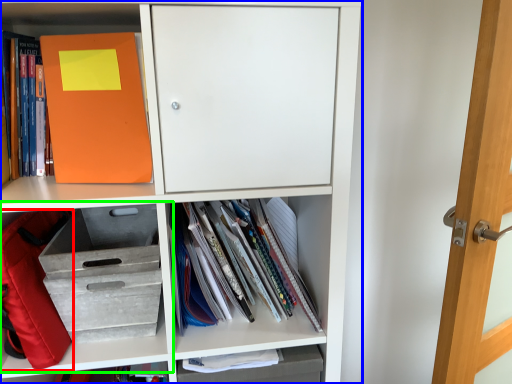
Question: Which is nearer to the backpack (highlighted by a red box)? shelf (highlighted by a blue box) or shelf (highlighted by a green box).

Choices:
 (A) shelf
 (B) shelf

Answer: (B)